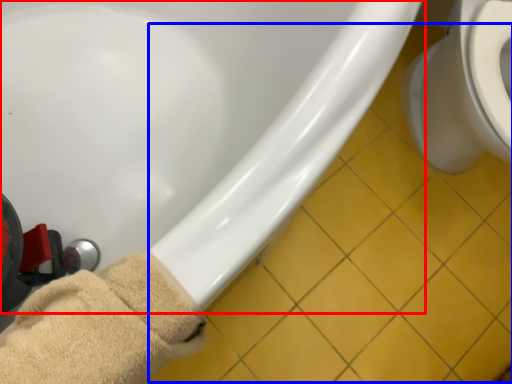
Question: Which point is further to the camera, bathtub (highlighted by a red box) or tile (highlighted by a blue box)?

Choices:
 (A) bathtub
 (B) tile

Answer: (B)